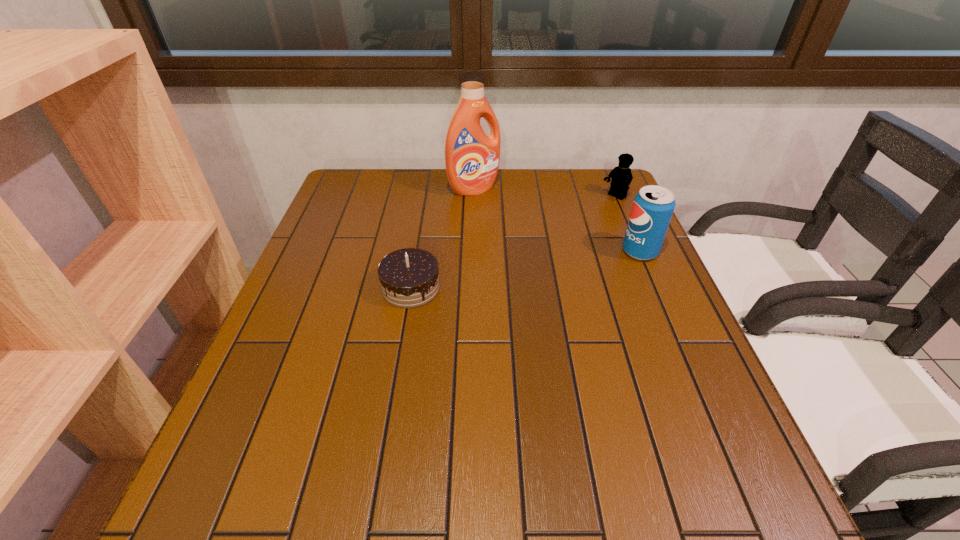
Locate an element on the screen. This screenshot has height=540, width=960. free space at the near edge is located at coordinates (445, 425).

Where is `vacant space at the left edge of the desktop`? vacant space at the left edge of the desktop is located at coordinates (367, 210).

Image resolution: width=960 pixels, height=540 pixels. Identify the location of vacant area at the right edge. (617, 310).

Locate an element on the screen. vacant space at the far left corner of the desktop is located at coordinates (375, 206).

The image size is (960, 540). I want to click on free space at the near left corner, so click(268, 413).

In the image, there is a desktop. Where is `vacant space at the far right corner`? This screenshot has height=540, width=960. vacant space at the far right corner is located at coordinates (572, 170).

This screenshot has width=960, height=540. Find the location of `vacant space that's between the Lego and the second tallest object`. vacant space that's between the Lego and the second tallest object is located at coordinates (627, 225).

Image resolution: width=960 pixels, height=540 pixels. Identify the location of free area in between the shortest object and the detergent. (443, 238).

Locate an element on the screen. The image size is (960, 540). free spot between the tallest object and the nearest object is located at coordinates (443, 238).

Locate an element on the screen. empty location between the tallest object and the third tallest object is located at coordinates (544, 193).